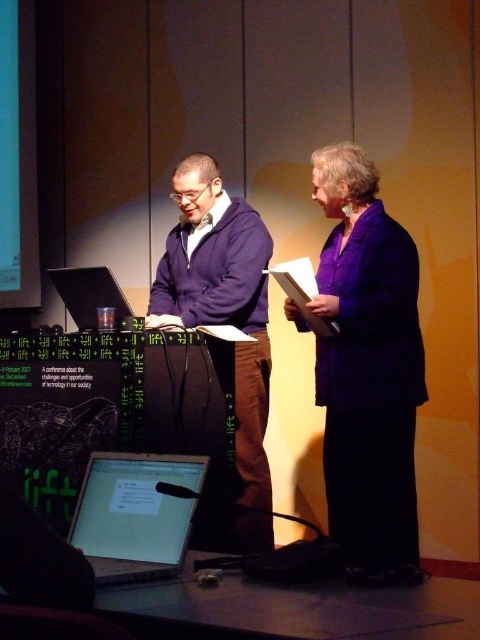
You are an attendee at the conference and want to approach the stage. From your perspective, which of the two points, point (396, 552) or point (159, 273), is closer to the front of the stage?

Point (396, 552) is in front of point (159, 273), so it is closer to the front of the stage.

You are attending a conference and standing in the front row. You notice the purple fleece jacket at center on stage. Can you comfortably reach into your pocket to retrieve your phone without disturbing others around you?

Yes, since the purple fleece jacket at center is 2.76 meters away from you, there is enough space to reach into your pocket without disturbing others.

You are an event organizer checking the stage setup. You need to ensure that the purple fleece jacket at center and the shiny silver laptop at lower left are visible to the audience. Given their sizes, which object might block the view of the other?

The purple fleece jacket at center is bigger than the shiny silver laptop at lower left, so it might block the view of the laptop if placed in front of it.